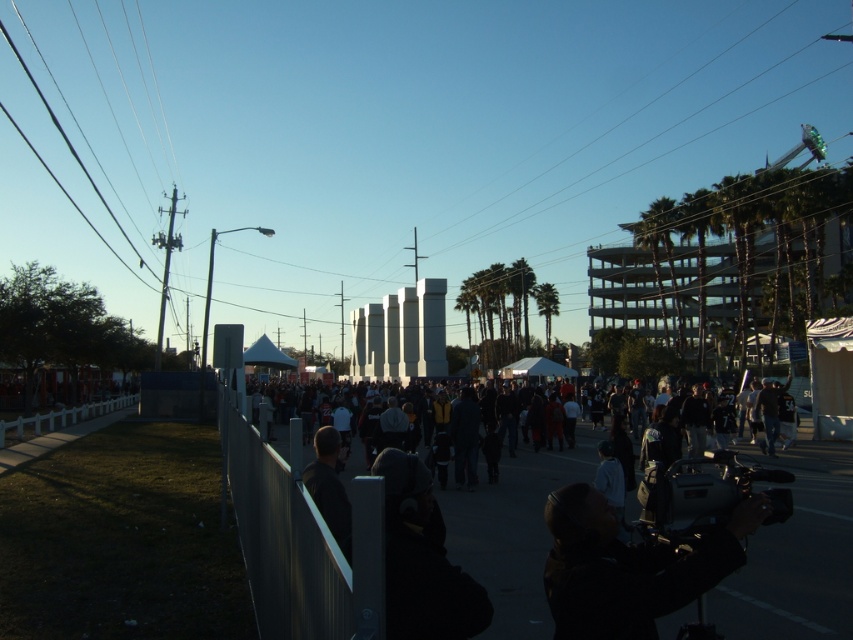
You are standing at the point marked as point (300,540) in the image. What object are you touching?

You are touching the metallic gray fence at center, as the point (300,540) is located on it.

You are standing at the center of the crowd in the foreground and want to take a photo of the entire scene. The black matte camera at lower right is positioned at coordinates 0.887, 0.737. Can you reach the camera from your current position without moving through the crowd?

The black matte camera at lower right is located at point (628, 566), so you can reach it by moving towards the lower right direction from the crowd center without necessarily moving through the dense crowd, depending on the crowd distribution.

You are a photographer trying to capture a shot of the dark clothing at center. The black matte camera at lower right is your only equipment. Can you position yourself so that the camera is directly facing the clothing without any obstructions?

The black matte camera at lower right is to the left of dark clothing at center, so positioning the camera directly facing the clothing would require moving it to the right side of the dark clothing at center to avoid being obstructed by the camera itself or other objects in between.